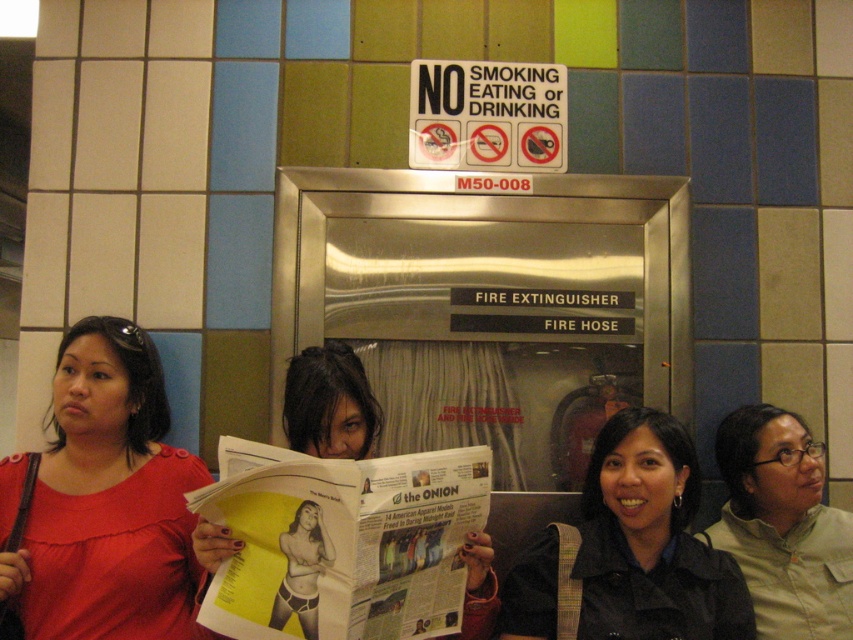
Question: Can you confirm if matte red blouse at left is thinner than black matte jacket at lower right?

Choices:
 (A) yes
 (B) no

Answer: (A)

Question: Among these points, which one is nearest to the camera?

Choices:
 (A) (520, 611)
 (B) (312, 416)
 (C) (811, 605)
 (D) (164, 480)

Answer: (B)

Question: Among these objects, which one is farthest from the camera?

Choices:
 (A) matte khaki shirt at lower right
 (B) matte red blouse at left
 (C) matte black hair at center

Answer: (A)

Question: Is matte red blouse at left below matte khaki shirt at lower right?

Choices:
 (A) no
 (B) yes

Answer: (A)

Question: Is matte red blouse at left below black matte jacket at lower right?

Choices:
 (A) no
 (B) yes

Answer: (A)

Question: Among these objects, which one is nearest to the camera?

Choices:
 (A) matte red blouse at left
 (B) matte black hair at center
 (C) black matte jacket at lower right
 (D) matte khaki shirt at lower right

Answer: (A)